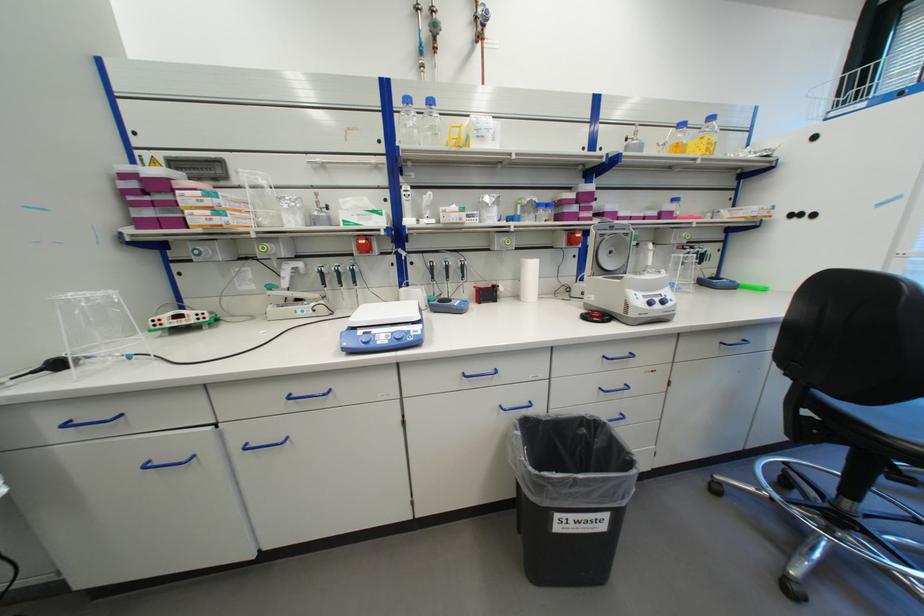
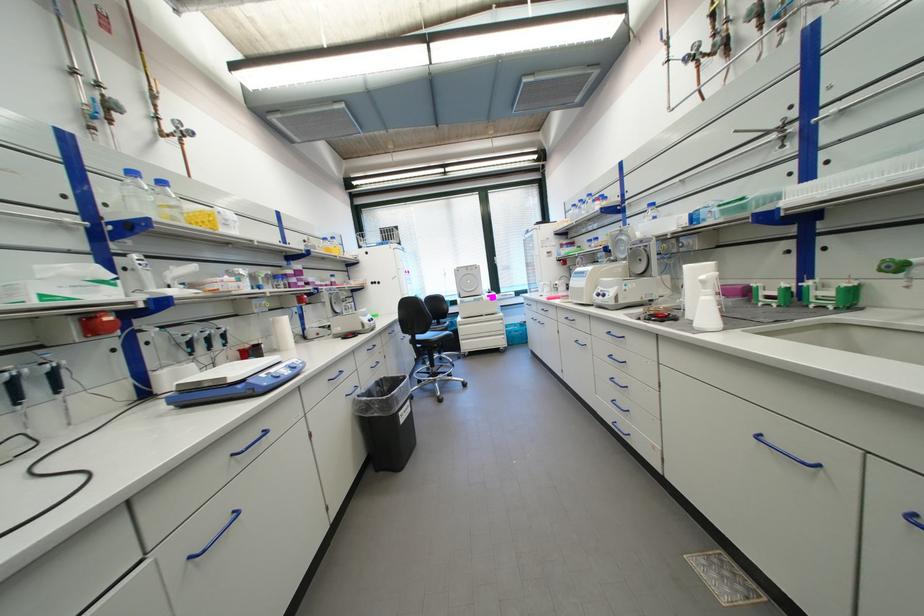
Find the pixel in the second image that matches [428,103] in the first image.

(156, 180)